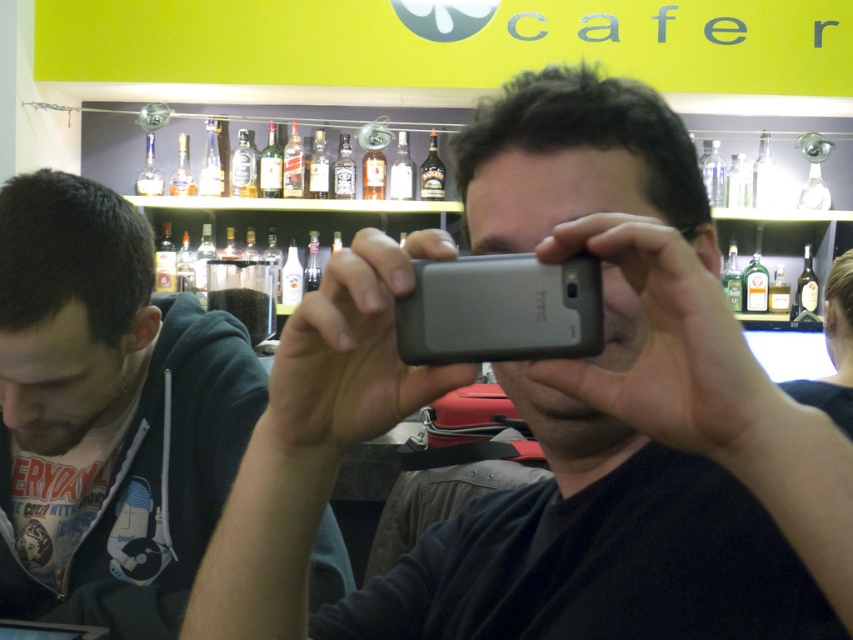
Is gray matte phone at center bigger than dark blue hoodie at left?

Actually, gray matte phone at center might be smaller than dark blue hoodie at left.

Is gray matte phone at center wider than dark blue hoodie at left?

In fact, gray matte phone at center might be narrower than dark blue hoodie at left.

Which is in front, point (314, 484) or point (137, 614)?

Point (314, 484)

The width and height of the screenshot is (853, 640). I want to click on gray matte phone at center, so click(556, 419).

Looking at this image, is dark blue hoodie at left wider than gray matte htc phone at center?

Yes, dark blue hoodie at left is wider than gray matte htc phone at center.

Which is more to the left, dark blue hoodie at left or gray matte htc phone at center?

From the viewer's perspective, dark blue hoodie at left appears more on the left side.

The image size is (853, 640). Describe the element at coordinates (108, 413) in the screenshot. I see `dark blue hoodie at left` at that location.

Find the location of a particular element. dark blue hoodie at left is located at coordinates (108, 413).

Which of these two, gray matte phone at center or gray matte htc phone at center, stands shorter?

Standing shorter between the two is gray matte htc phone at center.

The image size is (853, 640). What do you see at coordinates (556, 419) in the screenshot?
I see `gray matte phone at center` at bounding box center [556, 419].

Between point (715, 436) and point (476, 314), which one is positioned in front?

Positioned in front is point (715, 436).

This screenshot has height=640, width=853. I want to click on gray matte phone at center, so click(556, 419).